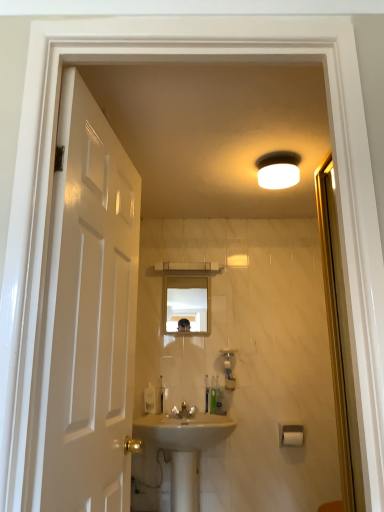
Question: Could white plastic toothbrush at center, the fifth toiletry in the right-to-left sequence, be considered to be inside translucent plastic toothbrush at center, which ranks as the 4th toiletry in left-to-right order?

Choices:
 (A) yes
 (B) no

Answer: (B)

Question: Is translucent plastic toothbrush at center, which ranks as the 4th toiletry in left-to-right order, positioned behind white plastic toothbrush at center, the 1th toiletry viewed from the left?

Choices:
 (A) no
 (B) yes

Answer: (B)

Question: Is translucent plastic toothbrush at center, the second toiletry positioned from the right, taller than white plastic toothbrush at center, the fifth toiletry in the right-to-left sequence?

Choices:
 (A) no
 (B) yes

Answer: (B)

Question: Is translucent plastic toothbrush at center, the second toiletry positioned from the right, positioned beyond the bounds of white plastic toothbrush at center, the 1th toiletry viewed from the left?

Choices:
 (A) no
 (B) yes

Answer: (B)

Question: Can you confirm if translucent plastic toothbrush at center, the second toiletry positioned from the right, is positioned to the right of white plastic toothbrush at center, the 1th toiletry viewed from the left?

Choices:
 (A) no
 (B) yes

Answer: (B)

Question: In the image, is green plastic toothbrush at lower center, marked as the 1th toiletry in a right-to-left arrangement, positioned in front of or behind translucent plastic soap dispenser at center?

Choices:
 (A) behind
 (B) front

Answer: (A)

Question: From a real-world perspective, is green plastic toothbrush at lower center, which is the 5th toiletry from left to right, physically located above or below translucent plastic soap dispenser at center?

Choices:
 (A) above
 (B) below

Answer: (B)

Question: Does point (220, 394) appear closer or farther from the camera than point (225, 352)?

Choices:
 (A) farther
 (B) closer

Answer: (B)

Question: In the image, is green plastic toothbrush at lower center, marked as the 1th toiletry in a right-to-left arrangement, on the left side or the right side of translucent plastic soap dispenser at center?

Choices:
 (A) left
 (B) right

Answer: (A)

Question: From their relative heights in the image, would you say beige ceramic sink at center is taller or shorter than clear glass mirror at center?

Choices:
 (A) short
 (B) tall

Answer: (B)

Question: Would you say beige ceramic sink at center is to the left or to the right of clear glass mirror at center in the picture?

Choices:
 (A) right
 (B) left

Answer: (B)

Question: Considering the positions of beige ceramic sink at center and clear glass mirror at center in the image, is beige ceramic sink at center bigger or smaller than clear glass mirror at center?

Choices:
 (A) big
 (B) small

Answer: (A)

Question: From a real-world perspective, relative to clear glass mirror at center, is beige ceramic sink at center vertically above or below?

Choices:
 (A) above
 (B) below

Answer: (B)

Question: In terms of width, does white plastic toothbrush at center, the 1th toiletry viewed from the left, look wider or thinner when compared to glossy white door at left?

Choices:
 (A) wide
 (B) thin

Answer: (B)

Question: In the image, is white plastic toothbrush at center, the fifth toiletry in the right-to-left sequence, on the left side or the right side of glossy white door at left?

Choices:
 (A) left
 (B) right

Answer: (B)